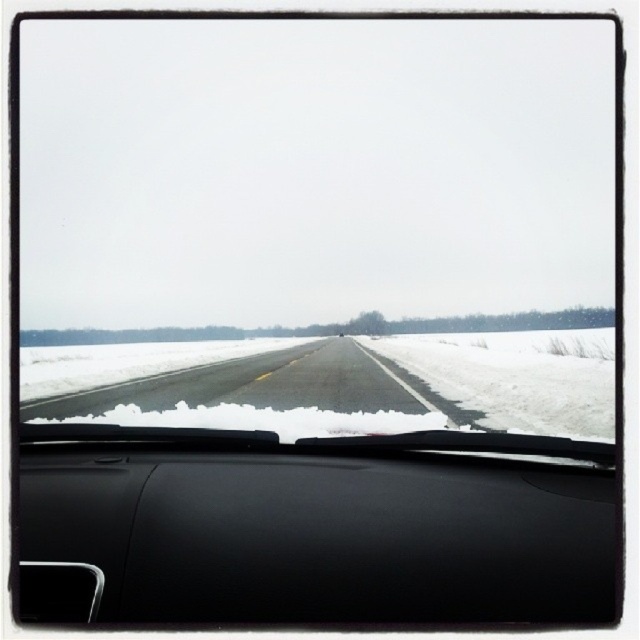
Question: Among these points, which one is farthest from the camera?

Choices:
 (A) (576, 502)
 (B) (182, 349)

Answer: (B)

Question: Which point appears farthest from the camera in this image?

Choices:
 (A) (305, 621)
 (B) (392, 390)

Answer: (B)

Question: Is black matte dashboard at center to the left of black asphalt highway at center from the viewer's perspective?

Choices:
 (A) no
 (B) yes

Answer: (A)

Question: Is black matte dashboard at center wider than black asphalt highway at center?

Choices:
 (A) no
 (B) yes

Answer: (A)

Question: Is black matte dashboard at center positioned in front of black asphalt highway at center?

Choices:
 (A) yes
 (B) no

Answer: (A)

Question: Which object appears closest to the camera in this image?

Choices:
 (A) black matte dashboard at center
 (B) black asphalt highway at center

Answer: (A)